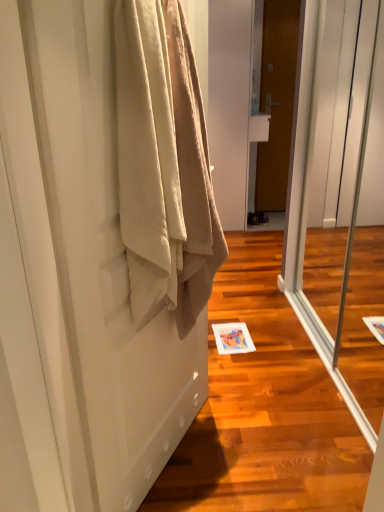
The height and width of the screenshot is (512, 384). I want to click on free spot in front of transparent glass screen door at center, so click(x=308, y=424).